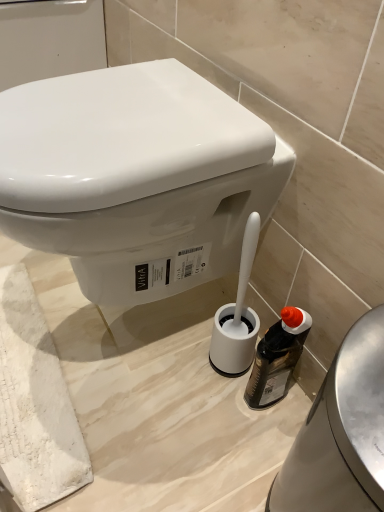
The width and height of the screenshot is (384, 512). What do you see at coordinates (341, 432) in the screenshot? I see `white plastic toilet brush holder at lower center` at bounding box center [341, 432].

The image size is (384, 512). What are the coordinates of `white plastic toilet brush holder at lower center` in the screenshot? It's located at (341, 432).

Is white plastic toilet brush holder at lower center not near translucent plastic bottle at lower right?

white plastic toilet brush holder at lower center is near translucent plastic bottle at lower right, not far away.

Could you measure the distance between white plastic toilet brush holder at lower center and translucent plastic bottle at lower right?

7.75 inches.

Does point (357, 400) come in front of point (283, 392)?

Yes, point (357, 400) is in front of point (283, 392).

Which object is positioned more to the right, white plastic toilet brush holder at lower center or translucent plastic bottle at lower right?

white plastic toilet brush holder at lower center.

Measure the distance between translucent plastic bottle at lower right and white glossy toilet at center.

13.12 inches.

From the picture: Is translucent plastic bottle at lower right far away from white glossy toilet at center?

No.

From a real-world perspective, which is physically below, translucent plastic bottle at lower right or white glossy toilet at center?

translucent plastic bottle at lower right, from a real-world perspective.

Considering the points (26, 121) and (319, 509), which point is behind, point (26, 121) or point (319, 509)?

Positioned behind is point (26, 121).

Measure the distance from white glossy toilet at center to white plastic toilet brush holder at lower center.

white glossy toilet at center is 15.85 inches away from white plastic toilet brush holder at lower center.

Can you tell me how much white glossy toilet at center and white plastic toilet brush holder at lower center differ in facing direction?

white glossy toilet at center and white plastic toilet brush holder at lower center are facing 0.769 degrees away from each other.

Would you consider white glossy toilet at center to be distant from white plastic toilet brush holder at lower center?

That's not correct — white glossy toilet at center is a little close to white plastic toilet brush holder at lower center.

From the image's perspective, would you say translucent plastic bottle at lower right is positioned over white plastic toilet brush holder at lower center?

Yes, from the image's perspective, translucent plastic bottle at lower right is on top of white plastic toilet brush holder at lower center.

Can you confirm if translucent plastic bottle at lower right is bigger than white plastic toilet brush holder at lower center?

No, translucent plastic bottle at lower right is not bigger than white plastic toilet brush holder at lower center.

Does translucent plastic bottle at lower right appear on the right side of white plastic toilet brush holder at lower center?

Incorrect, translucent plastic bottle at lower right is not on the right side of white plastic toilet brush holder at lower center.

Is point (298, 330) farther from camera compared to point (304, 480)?

That is True.

From a real-world perspective, is white glossy toilet at center physically below translucent plastic bottle at lower right?

Incorrect, from a real-world perspective, white glossy toilet at center is higher than translucent plastic bottle at lower right.

Which is in front, white glossy toilet at center or translucent plastic bottle at lower right?

white glossy toilet at center is closer to the camera.

Measure the distance between white glossy toilet at center and translucent plastic bottle at lower right.

white glossy toilet at center is 13.12 inches from translucent plastic bottle at lower right.

Which object is positioned more to the left, white glossy toilet at center or translucent plastic bottle at lower right?

white glossy toilet at center.

Is white plastic toilet brush holder at lower center far away from white glossy toilet at center?

white plastic toilet brush holder at lower center is actually quite close to white glossy toilet at center.

At what (x,y) coordinates should I click in order to perform the action: click on toilet behind the white plastic toilet brush holder at lower center. Please return your answer as a coordinate pair (x, y). The height and width of the screenshot is (512, 384). Looking at the image, I should click on (136, 177).

Is the depth of white plastic toilet brush holder at lower center less than that of white glossy toilet at center?

Yes, white plastic toilet brush holder at lower center is closer to the camera.

Where is `bottle that is on the left side of white plastic toilet brush holder at lower center`? bottle that is on the left side of white plastic toilet brush holder at lower center is located at coordinates (277, 358).

Locate an element on the screen. The image size is (384, 512). toilet above the translucent plastic bottle at lower right (from the image's perspective) is located at coordinates (136, 177).

Considering their positions, is white glossy toilet at center positioned closer to white plastic toilet brush holder at lower center than translucent plastic bottle at lower right?

The object closer to white plastic toilet brush holder at lower center is translucent plastic bottle at lower right.

When comparing their distances from translucent plastic bottle at lower right, does white glossy toilet at center or white plastic toilet brush holder at lower center seem further?

white glossy toilet at center.

Considering their positions, is translucent plastic bottle at lower right positioned closer to white glossy toilet at center than white plastic toilet brush holder at lower center?

The object closer to white glossy toilet at center is translucent plastic bottle at lower right.

When comparing their distances from white plastic toilet brush holder at lower center, does translucent plastic bottle at lower right or white glossy toilet at center seem further?

The object further to white plastic toilet brush holder at lower center is white glossy toilet at center.

When comparing their distances from white glossy toilet at center, does white plastic toilet brush holder at lower center or translucent plastic bottle at lower right seem further?

white plastic toilet brush holder at lower center is positioned further to the anchor white glossy toilet at center.

Looking at the image, which one is located closer to translucent plastic bottle at lower right, white plastic toilet brush holder at lower center or white glossy toilet at center?

white plastic toilet brush holder at lower center lies closer to translucent plastic bottle at lower right than the other object.

You are a GUI agent. You are given a task and a screenshot of the screen. Output one action in this format:
    pyautogui.click(x=<x>, y=<y>)
    Task: Click on the bottle that lies between white glossy toilet at center and white plastic toilet brush holder at lower center from top to bottom
    The image size is (384, 512).
    Given the screenshot: What is the action you would take?
    pyautogui.click(x=277, y=358)